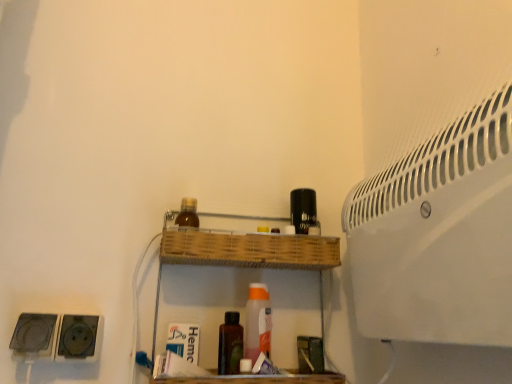
Question: Is wooden at center thinner than brown matte bottle at center, which ranks as the 2th bottle in left-to-right order?

Choices:
 (A) no
 (B) yes

Answer: (A)

Question: Does wooden at center have a greater width compared to brown matte bottle at center, the 2th bottle viewed from the top?

Choices:
 (A) yes
 (B) no

Answer: (A)

Question: From a real-world perspective, is wooden at center physically below brown matte bottle at center, which ranks as the 2th bottle in left-to-right order?

Choices:
 (A) no
 (B) yes

Answer: (A)

Question: Does wooden at center have a larger size compared to brown matte bottle at center, which is the first bottle in bottom-to-top order?

Choices:
 (A) no
 (B) yes

Answer: (B)

Question: Is wooden at center further to the viewer compared to brown matte bottle at center, which ranks as the 2th bottle in left-to-right order?

Choices:
 (A) yes
 (B) no

Answer: (B)

Question: Is point (279, 221) positioned closer to the camera than point (483, 327)?

Choices:
 (A) closer
 (B) farther

Answer: (B)

Question: Do you think wooden at center is within white plastic air conditioning unit at upper right, or outside of it?

Choices:
 (A) inside
 (B) outside

Answer: (B)

Question: From a real-world perspective, is wooden at center positioned above or below white plastic air conditioning unit at upper right?

Choices:
 (A) above
 (B) below

Answer: (B)

Question: Is wooden at center to the left or to the right of white plastic air conditioning unit at upper right in the image?

Choices:
 (A) left
 (B) right

Answer: (A)

Question: From their relative heights in the image, would you say black plastic speaker at lower left, acting as the first speaker starting from the left, is taller or shorter than white plastic air conditioning unit at upper right?

Choices:
 (A) short
 (B) tall

Answer: (A)

Question: Looking at their shapes, would you say black plastic speaker at lower left, acting as the first speaker starting from the left, is wider or thinner than white plastic air conditioning unit at upper right?

Choices:
 (A) wide
 (B) thin

Answer: (B)

Question: From a real-world perspective, relative to white plastic air conditioning unit at upper right, is black plastic speaker at lower left, which is the 2th speaker in right-to-left order, vertically above or below?

Choices:
 (A) below
 (B) above

Answer: (A)

Question: From the image's perspective, relative to white plastic air conditioning unit at upper right, is black plastic speaker at lower left, which is the 2th speaker in right-to-left order, above or below?

Choices:
 (A) below
 (B) above

Answer: (A)

Question: In the image, is black plastic speaker at lower left, which is the 2th speaker in right-to-left order, positioned in front of or behind brown glass bottle at upper center, the first bottle viewed from the top?

Choices:
 (A) behind
 (B) front

Answer: (B)

Question: Considering the relative positions of black plastic speaker at lower left, which is the 2th speaker in right-to-left order, and brown glass bottle at upper center, arranged as the first bottle when viewed from the left, in the image provided, is black plastic speaker at lower left, which is the 2th speaker in right-to-left order, to the left or to the right of brown glass bottle at upper center, arranged as the first bottle when viewed from the left,?

Choices:
 (A) right
 (B) left

Answer: (B)